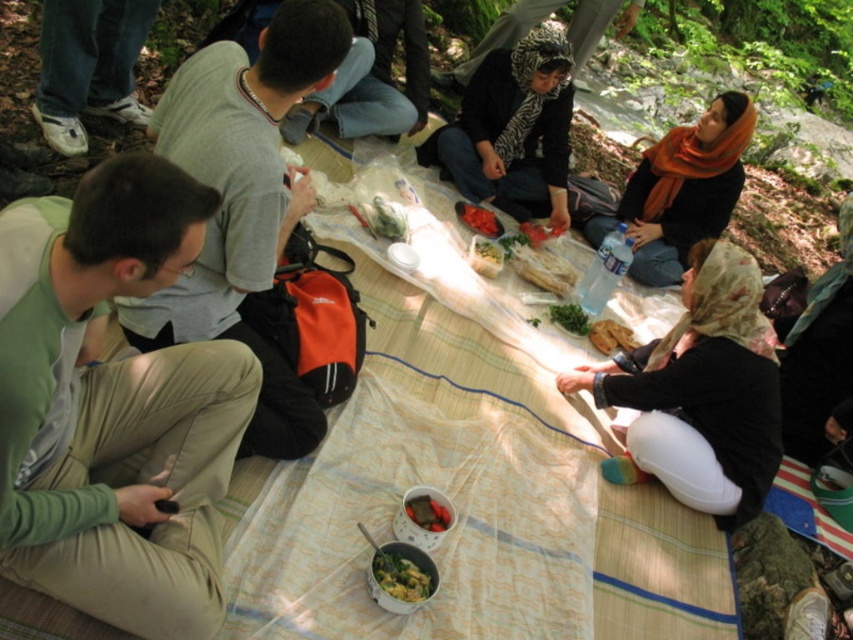
Question: Considering the real-world distances, which object is closest to the green matte bowl at center?

Choices:
 (A) smooth tomato at center
 (B) matte white bowl at center
 (C) green leafy vegetable at center

Answer: (B)

Question: Which of the following is the closest to the observer?

Choices:
 (A) smooth tomato at center
 (B) smooth plastic bowl at center
 (C) orange scarf at upper right

Answer: (B)

Question: Can you confirm if zebra-patterned scarf at center is wider than green matte bowl at center?

Choices:
 (A) no
 (B) yes

Answer: (B)

Question: Which object appears farthest from the camera in this image?

Choices:
 (A) orange scarf at upper right
 (B) zebra-patterned scarf at center

Answer: (A)

Question: Is gray fabric shirt at upper center thinner than smooth yellow bread at center?

Choices:
 (A) no
 (B) yes

Answer: (A)

Question: Is gray fabric shirt at upper center wider than smooth red tomato at center?

Choices:
 (A) no
 (B) yes

Answer: (B)